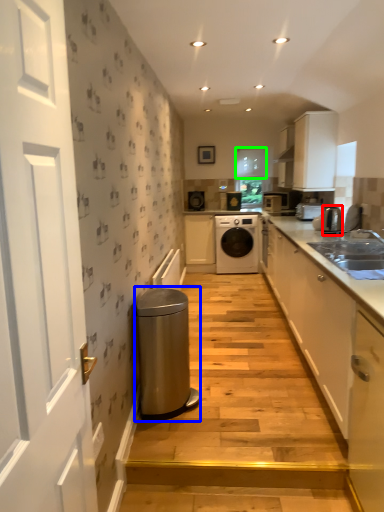
Question: Which object is positioned farthest from appliance (highlighted by a red box)? Select from water heater (highlighted by a blue box) and window (highlighted by a green box).

Choices:
 (A) water heater
 (B) window

Answer: (B)